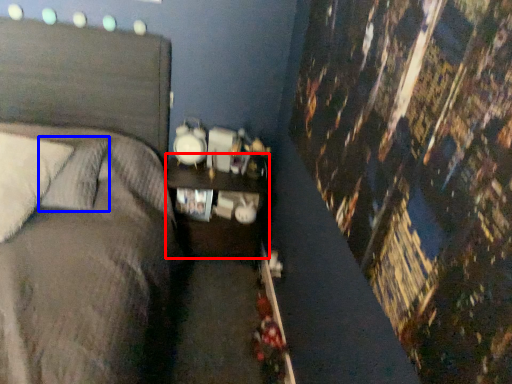
Question: Which point is further to the camera, nightstand (highlighted by a red box) or pillow (highlighted by a blue box)?

Choices:
 (A) nightstand
 (B) pillow

Answer: (A)